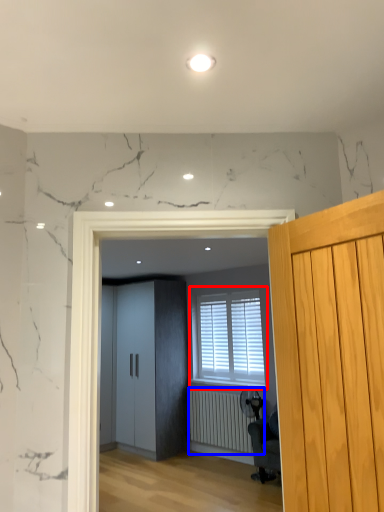
Question: Which object appears closest to the camera in this image, window (highlighted by a red box) or radiator (highlighted by a blue box)?

Choices:
 (A) window
 (B) radiator

Answer: (B)